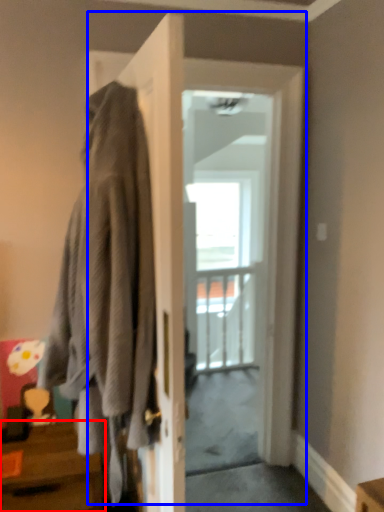
Question: Which object appears farthest to the camera in this image, table (highlighted by a red box) or door (highlighted by a blue box)?

Choices:
 (A) table
 (B) door

Answer: (B)